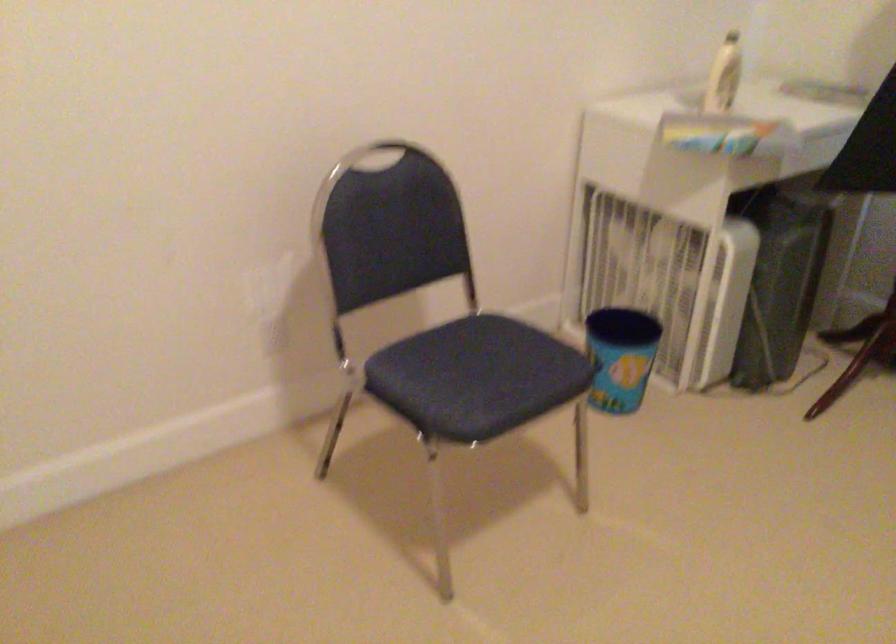
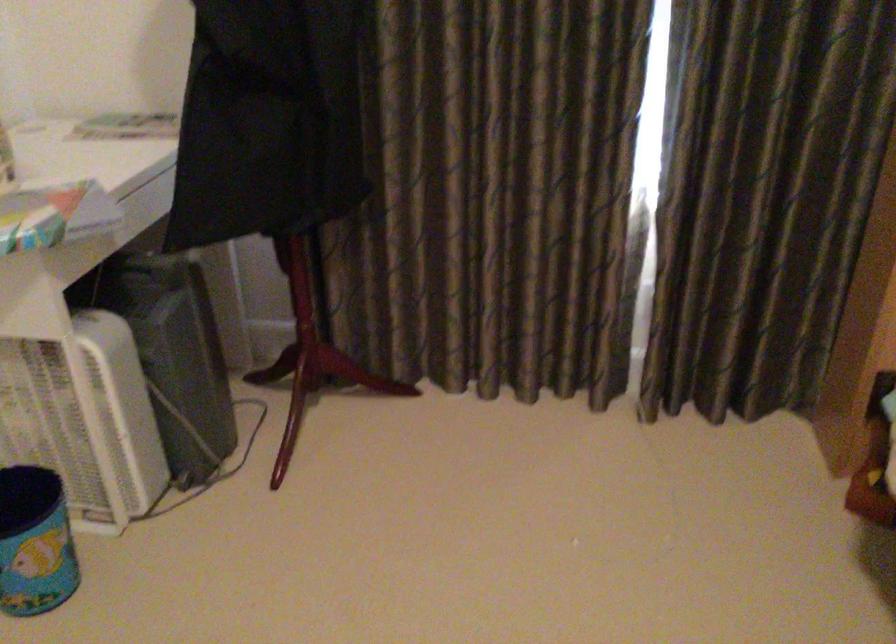
Locate, in the second image, the point that corresponds to point (630, 359) in the first image.

(35, 542)